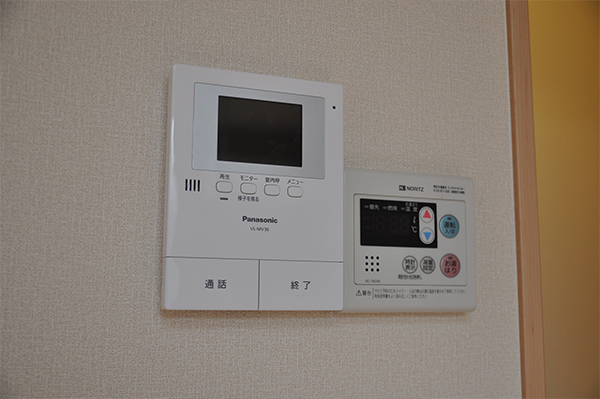
You are a GUI agent. You are given a task and a screenshot of the screen. Output one action in this format:
    pyautogui.click(x=<x>, y=<y>)
    Task: Click on the walls
    
    Given the screenshot: What is the action you would take?
    pyautogui.click(x=410, y=79), pyautogui.click(x=565, y=79)